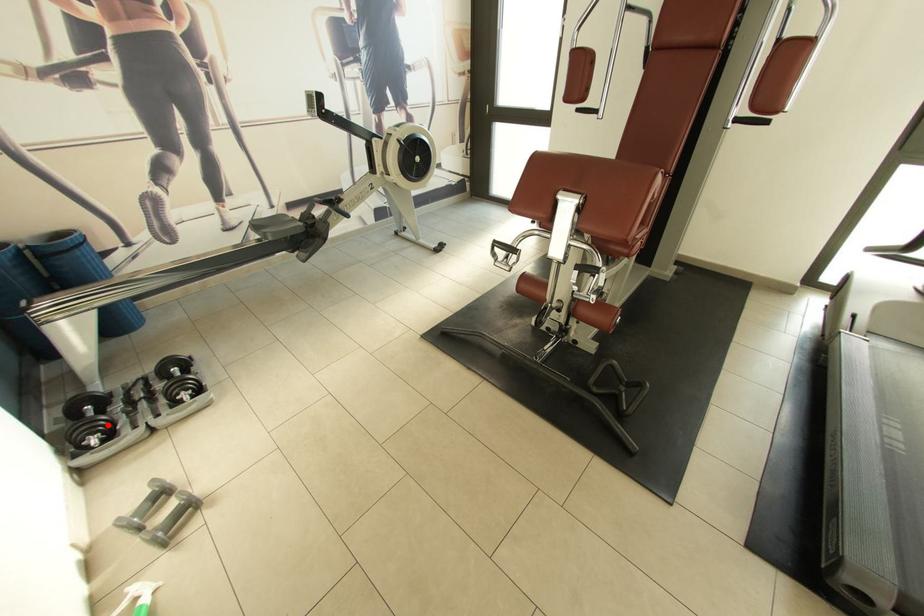
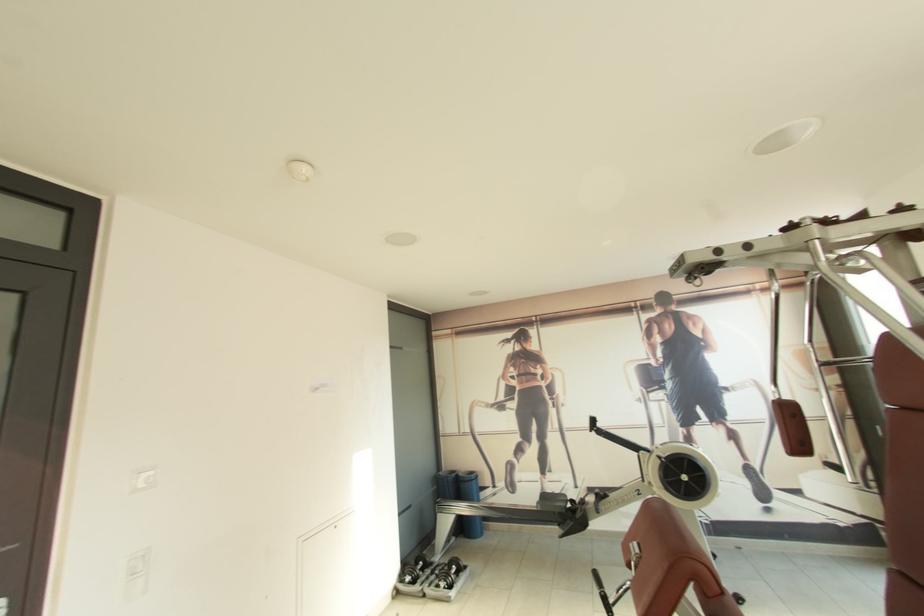
Question: A red point is marked in image1. In image2, is the corresponding 3D point closer to the camera or farther? Reply with the corresponding letter.

Choices:
 (A) The corresponding 3D point is closer.
 (B) The corresponding 3D point is farther.

Answer: (B)